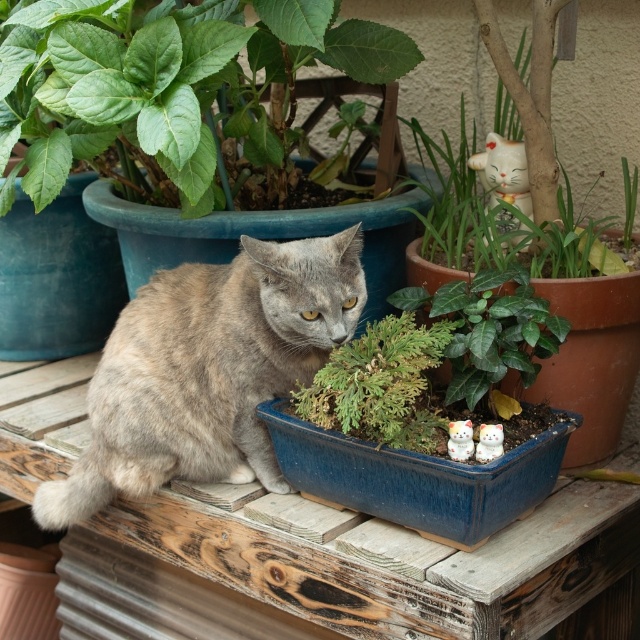
Question: Does gray fur cat at center have a larger size compared to green matte plant at center?

Choices:
 (A) no
 (B) yes

Answer: (B)

Question: Which object appears farthest from the camera in this image?

Choices:
 (A) green glossy plant at center
 (B) green matte plant at upper left

Answer: (B)

Question: Is green matte plant at center below green glossy plant at center?

Choices:
 (A) no
 (B) yes

Answer: (B)

Question: Which of the following is the closest to the observer?

Choices:
 (A) (500, 150)
 (B) (461, 378)

Answer: (B)

Question: Which point appears farthest from the camera in this image?

Choices:
 (A) (497, 170)
 (B) (401, 305)

Answer: (A)

Question: Where is green matte plant at center located in relation to white glossy cat at upper right in the image?

Choices:
 (A) above
 (B) below

Answer: (B)